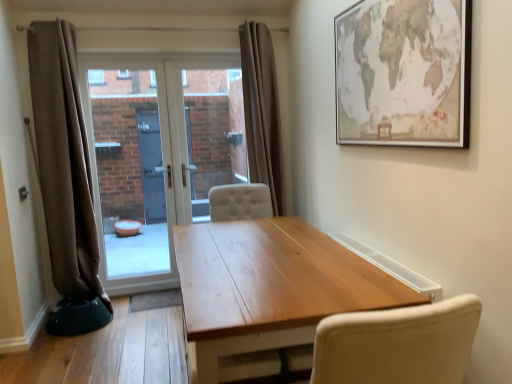
Question: From a real-world perspective, does wooden table at center stand above white glossy door at center?

Choices:
 (A) yes
 (B) no

Answer: (B)

Question: Is wooden table at center wider than white glossy door at center?

Choices:
 (A) no
 (B) yes

Answer: (B)

Question: Does wooden table at center lie in front of white glossy door at center?

Choices:
 (A) no
 (B) yes

Answer: (B)

Question: Is wooden table at center next to white glossy door at center and touching it?

Choices:
 (A) no
 (B) yes

Answer: (A)

Question: Would you say wooden table at center is outside white glossy door at center?

Choices:
 (A) yes
 (B) no

Answer: (A)

Question: Is wooden table at center behind white glossy door at center?

Choices:
 (A) no
 (B) yes

Answer: (A)

Question: Is transparent glass door at center, which is counted as the 1th window screen, starting from the left, thinner than brown fabric curtain at left, the 1th curtain from the left?

Choices:
 (A) yes
 (B) no

Answer: (A)

Question: From the image's perspective, is transparent glass door at center, which is the 2th window screen from right to left, over brown fabric curtain at left, which is the 2th curtain from right to left?

Choices:
 (A) no
 (B) yes

Answer: (A)

Question: Is transparent glass door at center, which is counted as the 1th window screen, starting from the left, bigger than brown fabric curtain at left, the 1th curtain from the left?

Choices:
 (A) no
 (B) yes

Answer: (A)

Question: From a real-world perspective, is transparent glass door at center, which is the 2th window screen from right to left, beneath brown fabric curtain at left, the 1th curtain from the left?

Choices:
 (A) yes
 (B) no

Answer: (A)

Question: Considering the relative sizes of transparent glass door at center, which is the 2th window screen from right to left, and brown fabric curtain at left, the 1th curtain from the left, in the image provided, is transparent glass door at center, which is the 2th window screen from right to left, shorter than brown fabric curtain at left, the 1th curtain from the left,?

Choices:
 (A) yes
 (B) no

Answer: (A)

Question: Is transparent glass door at center, which is counted as the 1th window screen, starting from the left, not inside brown fabric curtain at left, which is the 2th curtain from right to left?

Choices:
 (A) yes
 (B) no

Answer: (A)

Question: Is matte paper map at upper right positioned with its back to white glossy door at center?

Choices:
 (A) yes
 (B) no

Answer: (B)